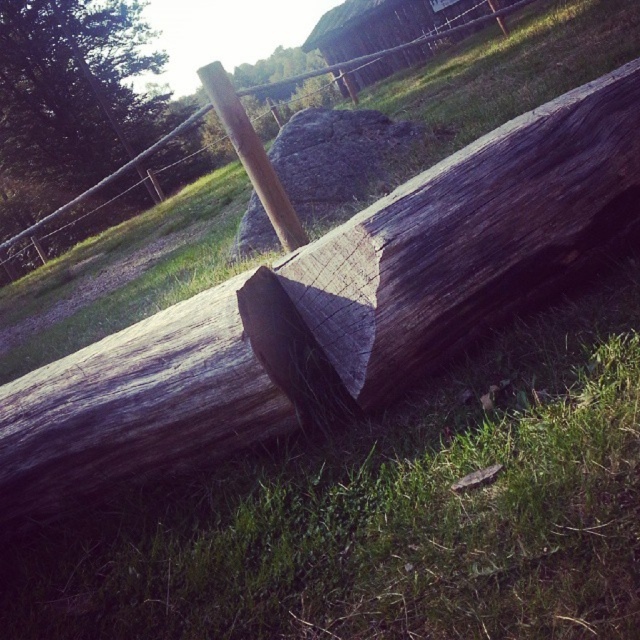
Between weathered wood log at center and wooden post at center, which one is positioned lower?

weathered wood log at center is below.

Who is more forward, (179, 410) or (234, 112)?

Point (179, 410) is more forward.

This screenshot has height=640, width=640. What do you see at coordinates (332, 310) in the screenshot?
I see `weathered wood log at center` at bounding box center [332, 310].

Image resolution: width=640 pixels, height=640 pixels. Identify the location of weathered wood log at center. (332, 310).

Who is lower down, wooden post at center or weathered wood post at center?

Positioned lower is wooden post at center.

Measure the distance between wooden post at center and camera.

wooden post at center is 3.52 meters away from camera.

Locate an element on the screen. This screenshot has height=640, width=640. wooden post at center is located at coordinates (252, 156).

The image size is (640, 640). I want to click on wooden post at center, so click(x=252, y=156).

Measure the distance between dark brown wood log at upper left and wooden post at center.

They are 24.22 meters apart.

Who is higher up, dark brown wood log at upper left or wooden post at center?

dark brown wood log at upper left

Which is in front, point (92, 76) or point (257, 148)?

Point (257, 148) is more forward.

Where is `dark brown wood log at upper left`? The image size is (640, 640). dark brown wood log at upper left is located at coordinates (74, 92).